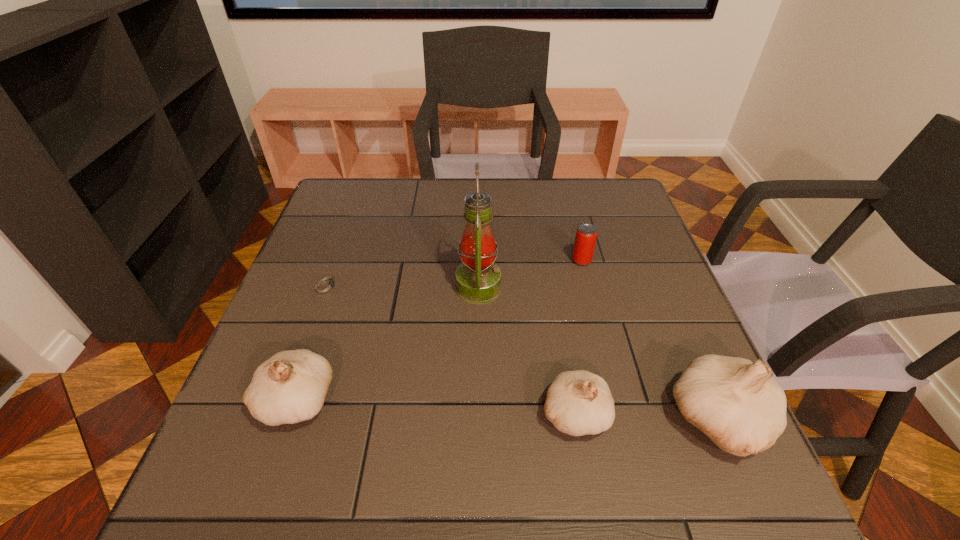
Locate an element on the screen. empty space between the watch and the fifth tallest object is located at coordinates (454, 273).

Where is `free space between the fourth object from right to left and the shortest garlic`? free space between the fourth object from right to left and the shortest garlic is located at coordinates (526, 350).

You are a GUI agent. You are given a task and a screenshot of the screen. Output one action in this format:
    pyautogui.click(x=<x>, y=<y>)
    Task: Click on the empty space between the rightmost object and the fourth shortest object
    Image resolution: width=960 pixels, height=540 pixels.
    Given the screenshot: What is the action you would take?
    pyautogui.click(x=508, y=410)

This screenshot has width=960, height=540. What are the coordinates of `vacant space in between the leftmost garlic and the rightmost garlic` in the screenshot? It's located at (508, 410).

Where is `object that can be found as the third closest to the second garlic from left to right`? The width and height of the screenshot is (960, 540). object that can be found as the third closest to the second garlic from left to right is located at coordinates (586, 235).

Point out which object is positioned as the nearest to the second tallest garlic. Please provide its 2D coordinates. Your answer should be formatted as a tuple, i.e. [(x, y)], where the tuple contains the x and y coordinates of a point satisfying the conditions above.

[(326, 285)]

Image resolution: width=960 pixels, height=540 pixels. In order to click on garlic identified as the closest to the watch in this screenshot , I will do `click(290, 387)`.

Identify the location of garlic that is the second closest to the shortest garlic. Image resolution: width=960 pixels, height=540 pixels. (290, 387).

Identify the location of vacant area in the image that satisfies the following two spatial constraints: 1. on the face of the shortest object; 2. on the left side of the shortest garlic. The image size is (960, 540). (279, 414).

Find the location of `free location that satisfies the following two spatial constraints: 1. on the back side of the fifth tallest object; 2. on the right side of the second garlic from right to left`. free location that satisfies the following two spatial constraints: 1. on the back side of the fifth tallest object; 2. on the right side of the second garlic from right to left is located at coordinates (548, 260).